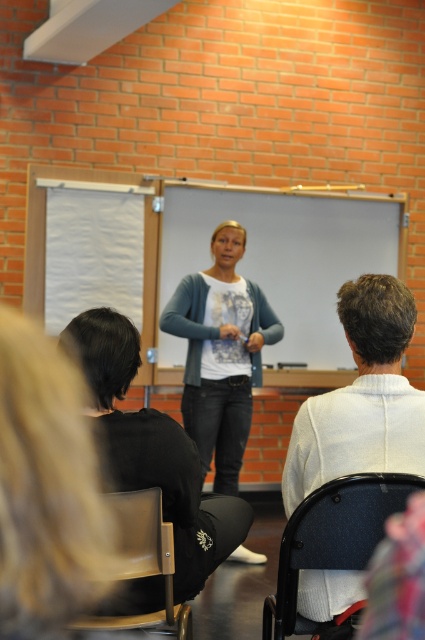
Can you confirm if white sweater at center is positioned to the left of matte blue cardigan at center?

In fact, white sweater at center is to the right of matte blue cardigan at center.

Can you confirm if white sweater at center is taller than matte blue cardigan at center?

Incorrect, white sweater at center's height is not larger of matte blue cardigan at center's.

Image resolution: width=425 pixels, height=640 pixels. I want to click on white sweater at center, so click(x=362, y=397).

Does white sweater at center have a smaller size compared to black fabric pants at lower left?

Yes.

Does point (388, 276) lie in front of point (133, 348)?

Yes.

Identify the location of white sweater at center. (362, 397).

Is black fabric pants at lower left positioned behind matte blue cardigan at center?

No, it is in front of matte blue cardigan at center.

Between black fabric pants at lower left and matte blue cardigan at center, which one is positioned higher?

matte blue cardigan at center is above.

Identify the location of black fabric pants at lower left. (153, 451).